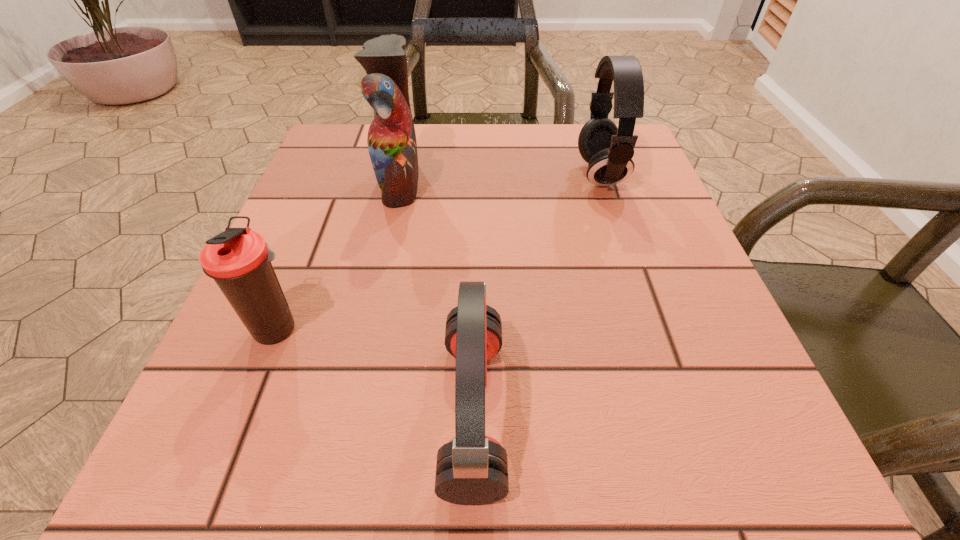
Locate an element on the screen. vacant space at the far edge is located at coordinates (521, 128).

This screenshot has width=960, height=540. I want to click on free space at the near edge of the desktop, so click(x=597, y=501).

What are the coordinates of `free region at the left edge of the desktop` in the screenshot? It's located at (325, 264).

In the image, there is a desktop. Where is `vacant space at the right edge`? vacant space at the right edge is located at coordinates click(673, 225).

Identify the location of blank area at the far right corner. (645, 159).

Where is `vacant area between the left earphone and the parrot`? The image size is (960, 540). vacant area between the left earphone and the parrot is located at coordinates (437, 296).

You are a GUI agent. You are given a task and a screenshot of the screen. Output one action in this format:
    pyautogui.click(x=<x>, y=<y>)
    Task: Click on the vacant area that lies between the rightmost object and the parrot
    Image resolution: width=960 pixels, height=540 pixels.
    Given the screenshot: What is the action you would take?
    pyautogui.click(x=500, y=178)

The image size is (960, 540). What are the coordinates of `blank region between the taller earphone and the parrot` in the screenshot? It's located at (500, 178).

Where is `vacant space that is in between the second object from left to right and the taller earphone`? Image resolution: width=960 pixels, height=540 pixels. vacant space that is in between the second object from left to right and the taller earphone is located at coordinates (500, 178).

Identify the location of free space between the third object from right to left and the nearer earphone. The image size is (960, 540). (437, 296).